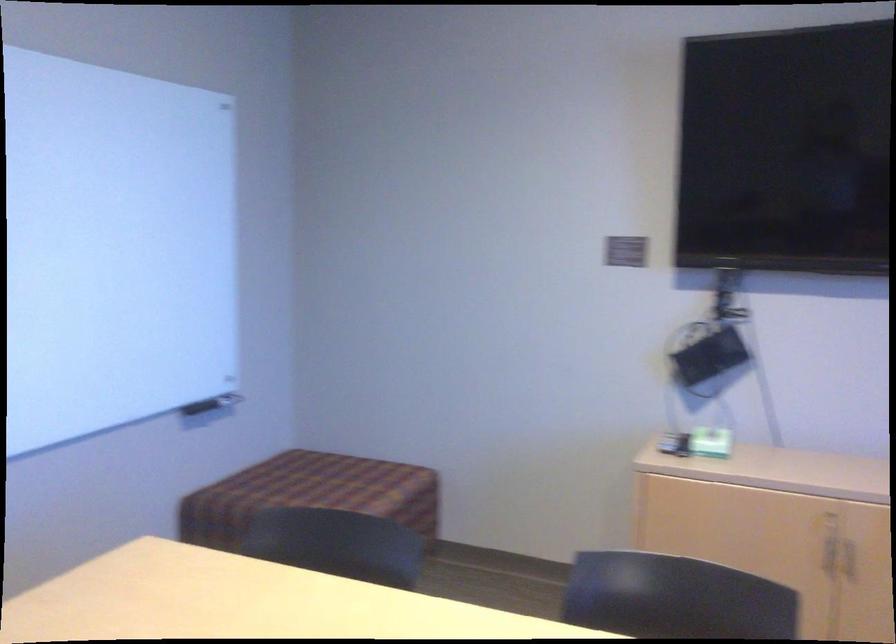
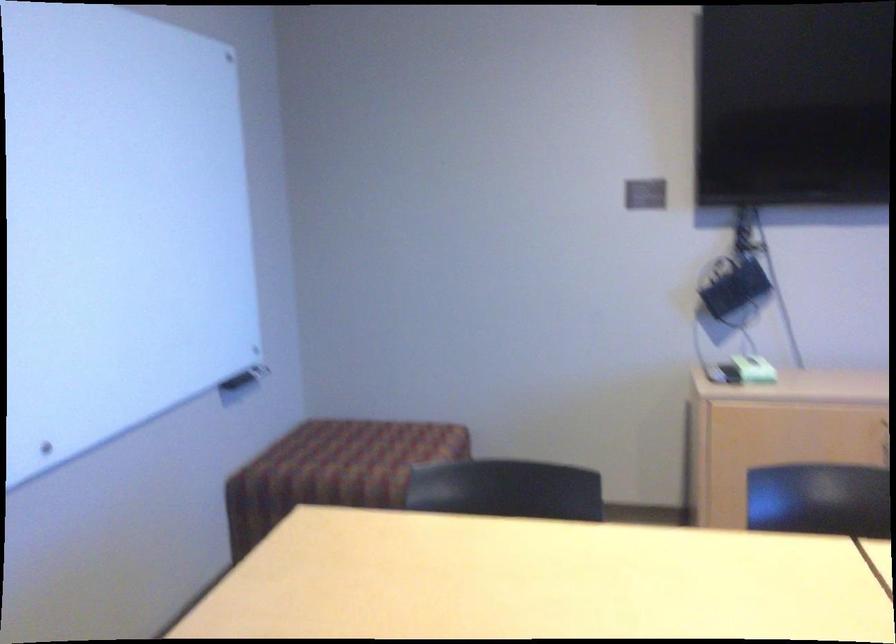
Locate, in the second image, the point that corresponds to pixel 282 496 in the first image.

(331, 465)